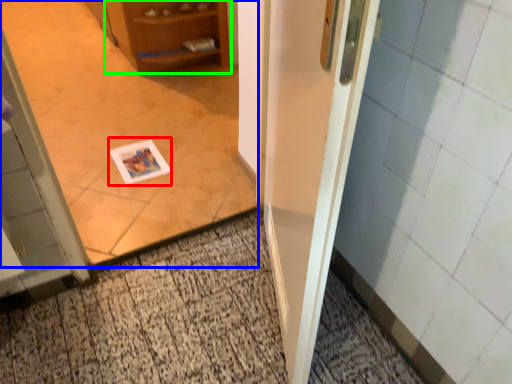
Question: Considering the real-world distances, which object is farthest from postcard (highlighted by a red box)? corridor (highlighted by a blue box) or cabinetry (highlighted by a green box)?

Choices:
 (A) corridor
 (B) cabinetry

Answer: (B)